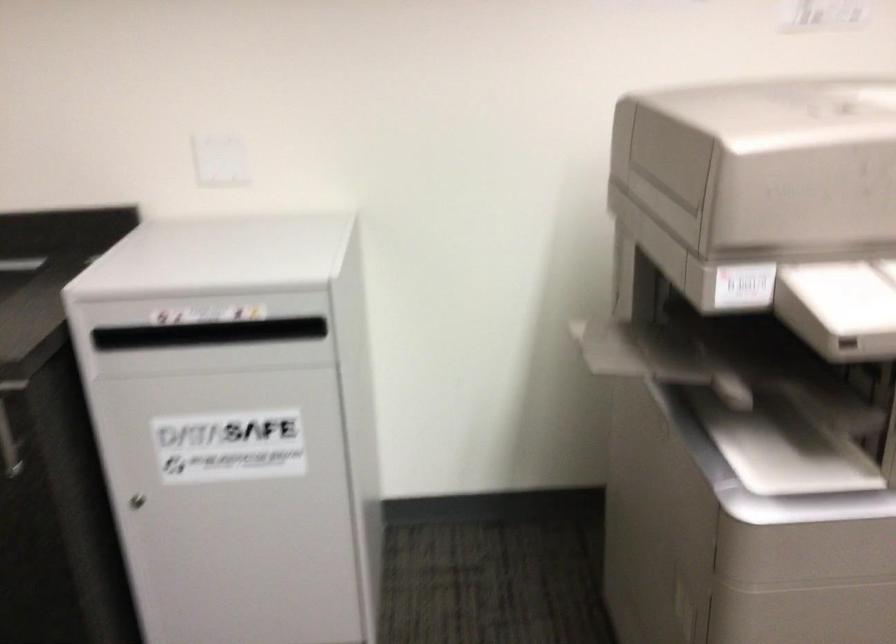
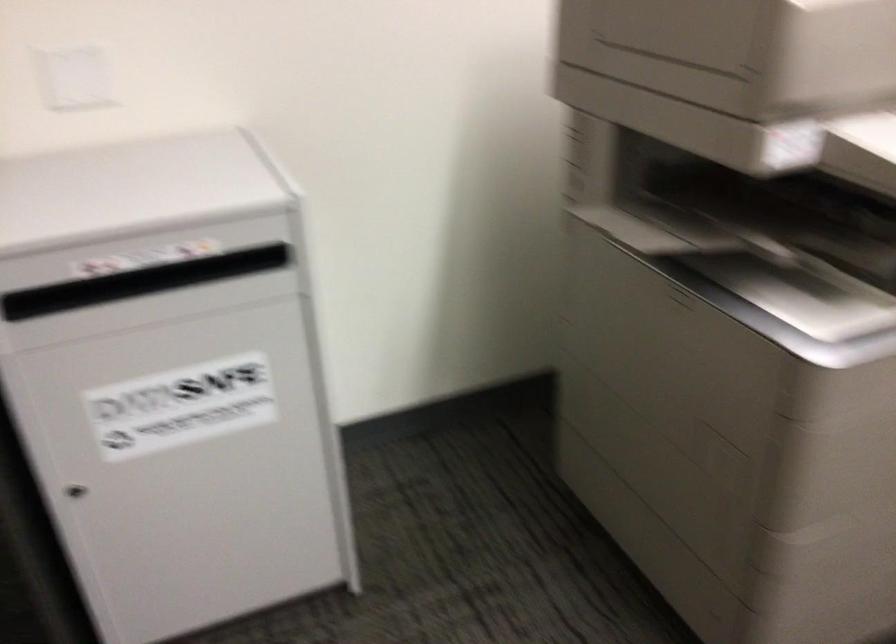
Question: The first image is from the beginning of the video and the second image is from the end. How did the camera likely rotate when shooting the video?

Choices:
 (A) Left
 (B) Right
 (C) Up
 (D) Down

Answer: (B)